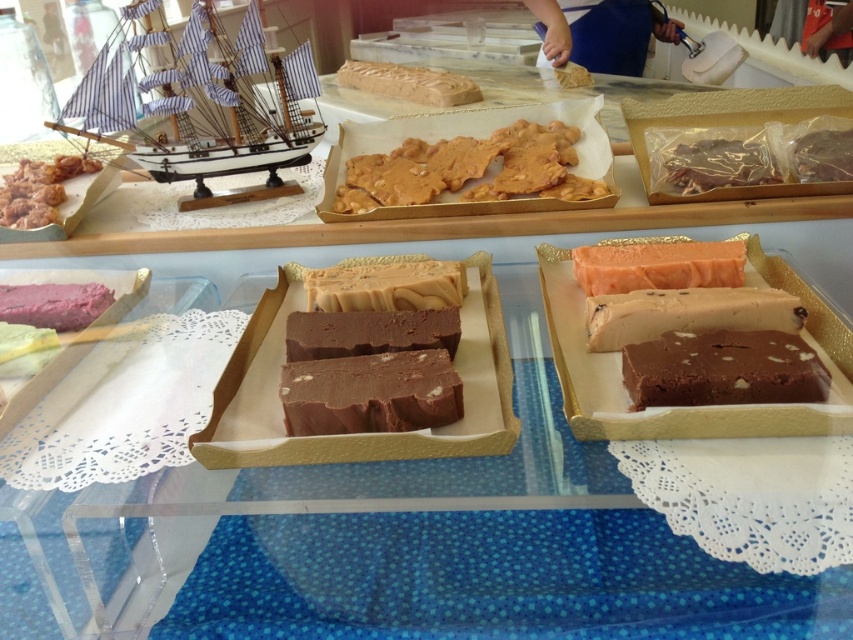
Is golden crunchy candy at center wider than salmon-colored fudge at center?

Yes, golden crunchy candy at center is wider than salmon-colored fudge at center.

Who is taller, golden crunchy candy at center or salmon-colored fudge at center?

golden crunchy candy at center is taller.

The image size is (853, 640). I want to click on golden crunchy candy at center, so click(x=469, y=172).

Who is positioned more to the right, smooth caramel bar at center or brown crumbly chocolate at upper right?

brown crumbly chocolate at upper right

Is point (386, 90) positioned in front of point (840, 131)?

No, it is not.

At what (x,y) coordinates should I click in order to perform the action: click on smooth caramel bar at center. Please return your answer as a coordinate pair (x, y). Looking at the image, I should click on (409, 83).

At what (x,y) coordinates should I click in order to perform the action: click on smooth caramel bar at center. Please return your answer as a coordinate pair (x, y). Image resolution: width=853 pixels, height=640 pixels. Looking at the image, I should click on (409, 83).

Can you confirm if golden crunchy candy at center is positioned above brown crumbly chocolate at upper right?

No.

Can you confirm if golden crunchy candy at center is positioned to the right of brown crumbly chocolate at upper right?

In fact, golden crunchy candy at center is to the left of brown crumbly chocolate at upper right.

Where is `golden crunchy candy at center`? golden crunchy candy at center is located at coordinates (469, 172).